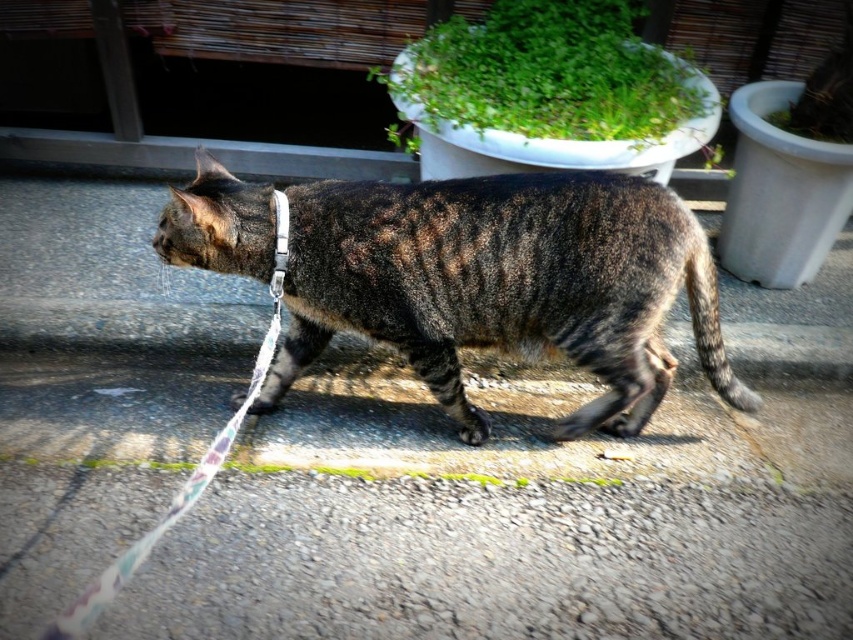
Question: Which of the following is the farthest from the observer?

Choices:
 (A) gray asphalt at center
 (B) striped fur cat at center
 (C) green leafy plant at upper center

Answer: (C)

Question: Does gray asphalt at center appear under striped fur cat at center?

Choices:
 (A) no
 (B) yes

Answer: (B)

Question: Which object is positioned closest to the striped fur cat at center?

Choices:
 (A) gray asphalt at center
 (B) green leafy plant at upper center

Answer: (A)

Question: Among these points, which one is farthest from the camera?

Choices:
 (A) (643, 104)
 (B) (415, 307)

Answer: (A)

Question: Is striped fur cat at center to the left of green leafy plant at upper center from the viewer's perspective?

Choices:
 (A) no
 (B) yes

Answer: (B)

Question: Is gray asphalt at center further to the viewer compared to striped fur cat at center?

Choices:
 (A) no
 (B) yes

Answer: (A)